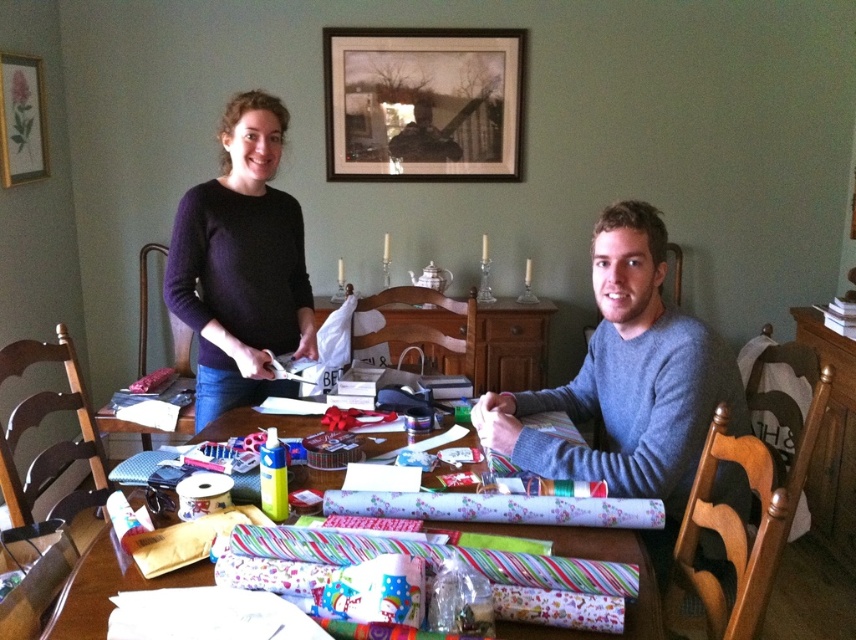
You are standing in the room and want to place a new poster on the wall. The poster must be placed exactly where the wooden picture frame at upper center is currently located. What are the coordinates of the point where you should place the poster?

The wooden picture frame at upper center is located at coordinates 0.163 and 0.494, so you should place the poster at those coordinates.

You are helping to organize the gift wrapping station. The wooden picture frame at upper center needs to be moved to the left side of the wrapping paper rolls at center. Is this possible without moving the wrapping paper rolls?

The wooden picture frame at upper center is currently to the right of the wrapping paper rolls at center. To move it to the left side of the rolls, you would need to shift it past the rolls, which would require moving the wrapping paper rolls at center first.